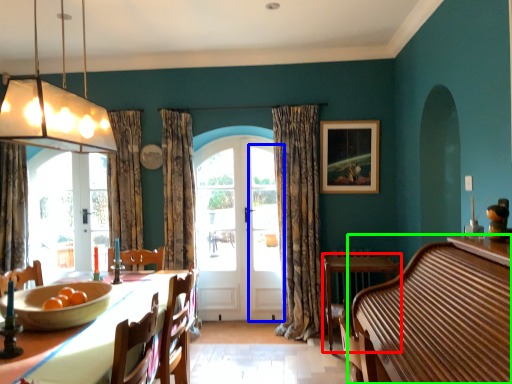
Question: Considering the real-world distances, which object is farthest from round table (highlighted by a red box)? screen door (highlighted by a blue box) or dresser (highlighted by a green box)?

Choices:
 (A) screen door
 (B) dresser

Answer: (B)